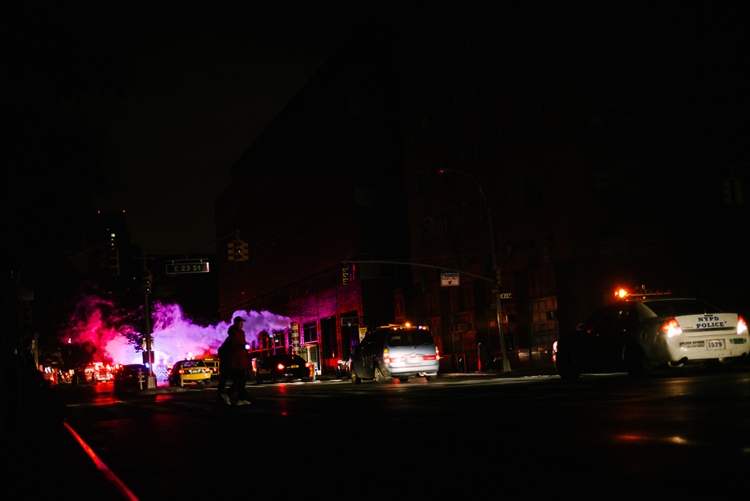
Where is `door`? door is located at coordinates (351, 332).